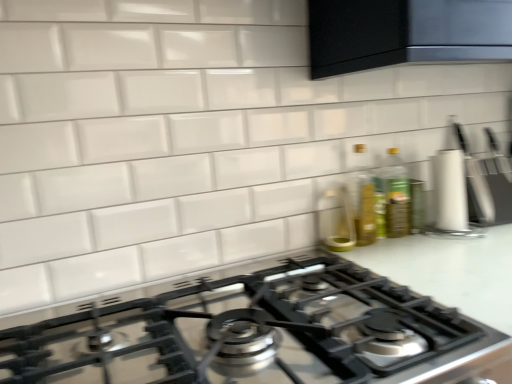
Where is `vacant area that is situated to the right of clear glass bottle at center`? This screenshot has height=384, width=512. vacant area that is situated to the right of clear glass bottle at center is located at coordinates (405, 246).